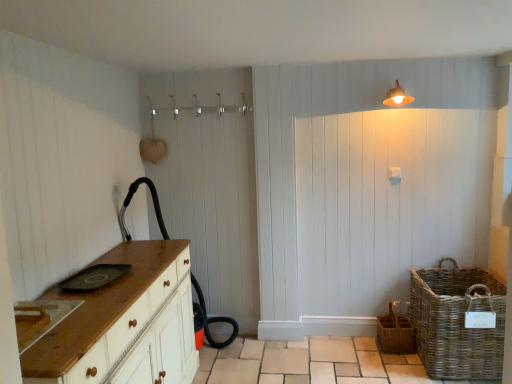
Question: From the image's perspective, does woven brown basket at lower right, the 2th basket when ordered from left to right, appear lower than matte white light fixture at upper right?

Choices:
 (A) no
 (B) yes

Answer: (B)

Question: Is woven brown basket at lower right, the 2th basket when ordered from left to right, positioned behind matte white light fixture at upper right?

Choices:
 (A) no
 (B) yes

Answer: (A)

Question: Is matte white light fixture at upper right completely or partially inside woven brown basket at lower right, the 2th basket when ordered from left to right?

Choices:
 (A) no
 (B) yes

Answer: (A)

Question: Can you confirm if woven brown basket at lower right, which is counted as the 1th basket, starting from the right, is thinner than matte white light fixture at upper right?

Choices:
 (A) no
 (B) yes

Answer: (A)

Question: Does woven brown basket at lower right, the 2th basket when ordered from left to right, come in front of matte white light fixture at upper right?

Choices:
 (A) no
 (B) yes

Answer: (B)

Question: Are woven brown basket at lower right, the 2th basket when ordered from left to right, and matte white light fixture at upper right making contact?

Choices:
 (A) no
 (B) yes

Answer: (A)

Question: Is the surface of woven brown basket at lower right, the 2th basket when ordered from left to right, in direct contact with wooden chest of drawers at left?

Choices:
 (A) yes
 (B) no

Answer: (B)

Question: Is wooden chest of drawers at left a part of woven brown basket at lower right, which is counted as the 1th basket, starting from the right?

Choices:
 (A) no
 (B) yes

Answer: (A)

Question: Can you confirm if woven brown basket at lower right, the 2th basket when ordered from left to right, is positioned to the right of wooden chest of drawers at left?

Choices:
 (A) yes
 (B) no

Answer: (A)

Question: Can you confirm if woven brown basket at lower right, the 2th basket when ordered from left to right, is smaller than wooden chest of drawers at left?

Choices:
 (A) yes
 (B) no

Answer: (A)

Question: From a real-world perspective, is woven brown basket at lower right, which is counted as the 1th basket, starting from the right, on wooden chest of drawers at left?

Choices:
 (A) no
 (B) yes

Answer: (A)

Question: From the image's perspective, would you say woven brown basket at lower right, which is counted as the 1th basket, starting from the right, is shown under wooden chest of drawers at left?

Choices:
 (A) no
 (B) yes

Answer: (A)

Question: Considering the relative sizes of wooden chest of drawers at left and woven brown basket at lower right, the 2th basket when ordered from left to right, in the image provided, is wooden chest of drawers at left taller than woven brown basket at lower right, the 2th basket when ordered from left to right,?

Choices:
 (A) no
 (B) yes

Answer: (B)